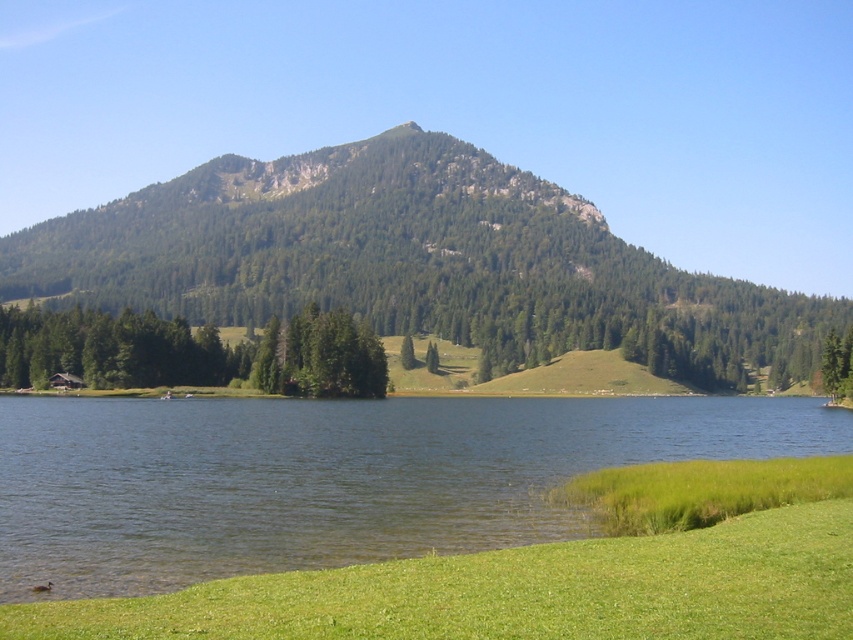
How far apart are green grassy shore at lower right and green forested mountain at center?

green grassy shore at lower right is 606.71 feet from green forested mountain at center.

Between green grassy shore at lower right and green forested mountain at center, which one has more height?

green forested mountain at center

Is point (471, 476) behind point (44, 228)?

No, it is not.

Where is `green grassy shore at lower right`? green grassy shore at lower right is located at coordinates (331, 477).